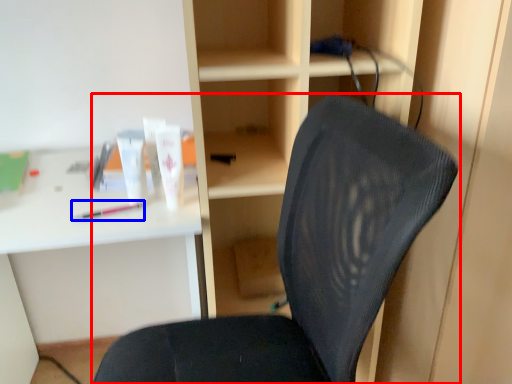
Question: Among these objects, which one is farthest to the camera, chair (highlighted by a red box) or stationery (highlighted by a blue box)?

Choices:
 (A) chair
 (B) stationery

Answer: (B)